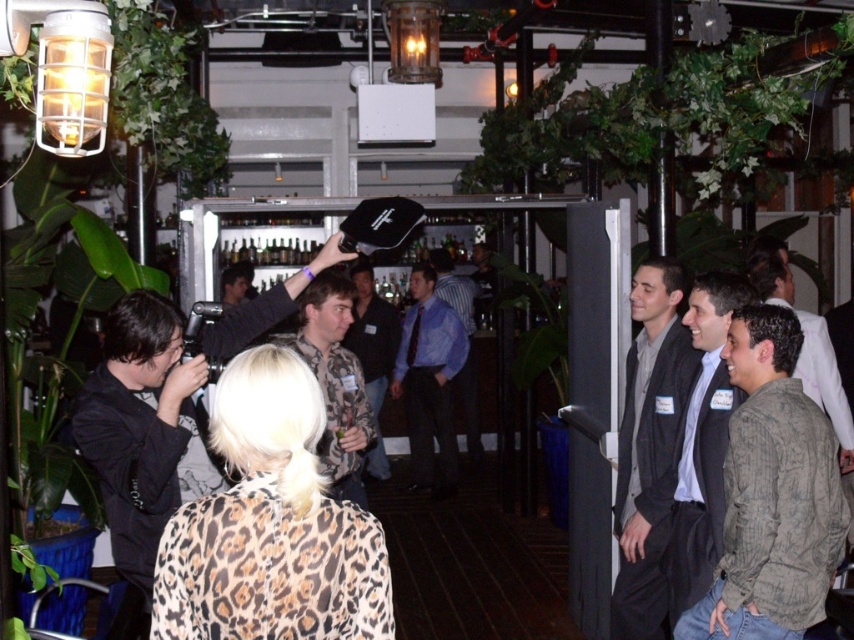
You are at the event and want to take a photo of the dark gray suit at right and the gray striped shirt at right. Which one should you focus on first to ensure both are in focus?

You should focus on the dark gray suit at right first since it is closer to you than the gray striped shirt at right, allowing the camera to adjust focus starting from the nearest subject.

You are at the event and want to take a photo of both the gray plaid shirt at center and the camouflage shirt at center. Which shirt should you focus on first if you want to capture both in the frame without moving the camera?

The gray plaid shirt at center is smaller than the camouflage shirt at center, so you should focus on the gray plaid shirt at center first to ensure it fits within the frame since it is smaller and might require more precise framing.

You are at a social gathering and see two people wearing the gray plaid shirt at center and the camouflage shirt at center. Which one is positioned more to the right?

The gray plaid shirt at center is positioned more to the right than the camouflage shirt at center.